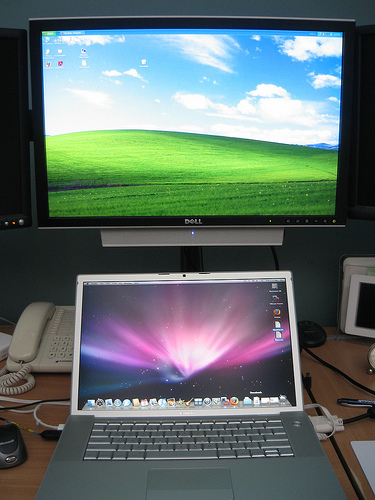
You are a GUI agent. You are given a task and a screenshot of the screen. Output one action in this format:
    pyautogui.click(x=<x>, y=<y>)
    Task: Click on the laptop keyboard
    
    Given the screenshot: What is the action you would take?
    pyautogui.click(x=170, y=451)